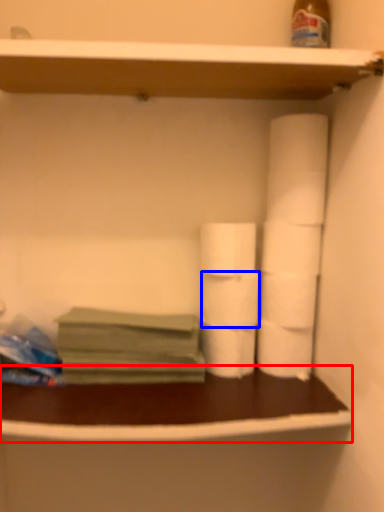
Question: Which point is closer to the camera, counter (highlighted by a red box) or toilet paper (highlighted by a blue box)?

Choices:
 (A) counter
 (B) toilet paper

Answer: (A)